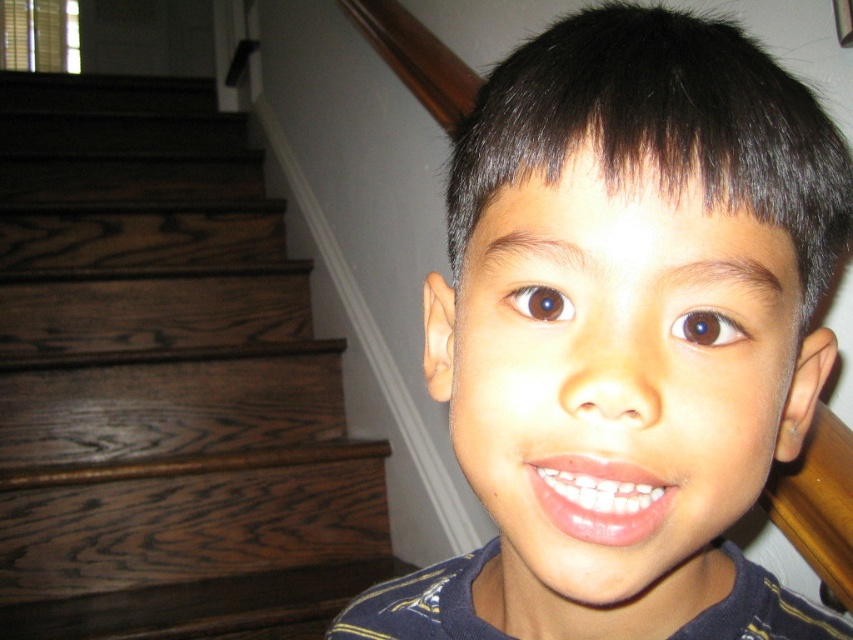
Can you confirm if smooth skin face at center is taller than dark brown wood stairs at left?

In fact, smooth skin face at center may be shorter than dark brown wood stairs at left.

Does point (695, 172) lie in front of point (96, 592)?

That is True.

Is point (525, 483) positioned in front of point (16, 358)?

Yes, point (525, 483) is closer to viewer.

This screenshot has width=853, height=640. I want to click on smooth skin face at center, so click(x=625, y=333).